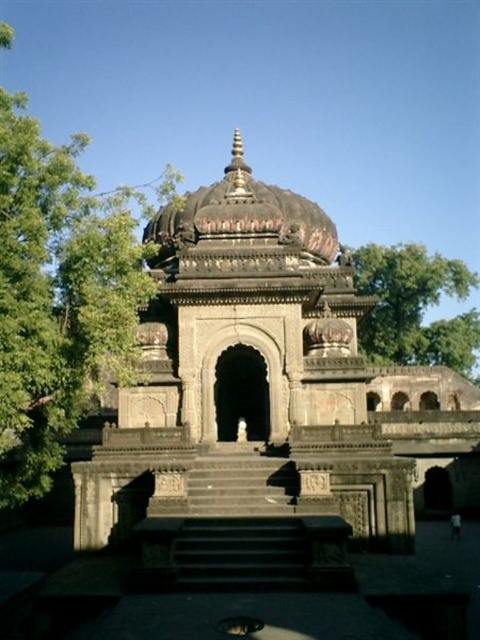
Question: Which object appears farthest from the camera in this image?

Choices:
 (A) dark stone dome at center
 (B) dark brown stone dome at center
 (C) green leafy tree at upper right

Answer: (C)

Question: Which of the following is the closest to the observer?

Choices:
 (A) green leafy tree at left
 (B) green leafy tree at upper right
 (C) dark brown stone dome at center

Answer: (A)

Question: Can you confirm if green leafy tree at left is positioned above dark brown stone dome at center?

Choices:
 (A) no
 (B) yes

Answer: (B)

Question: Estimate the real-world distances between objects in this image. Which object is farther from the green leafy tree at upper right?

Choices:
 (A) green leafy tree at left
 (B) dark brown stone dome at center
 (C) dark stone dome at center

Answer: (A)

Question: Considering the relative positions of green leafy tree at upper right and dark brown stone dome at center in the image provided, where is green leafy tree at upper right located with respect to dark brown stone dome at center?

Choices:
 (A) left
 (B) right

Answer: (B)

Question: Can you confirm if green leafy tree at upper right is wider than dark brown stone dome at center?

Choices:
 (A) no
 (B) yes

Answer: (B)